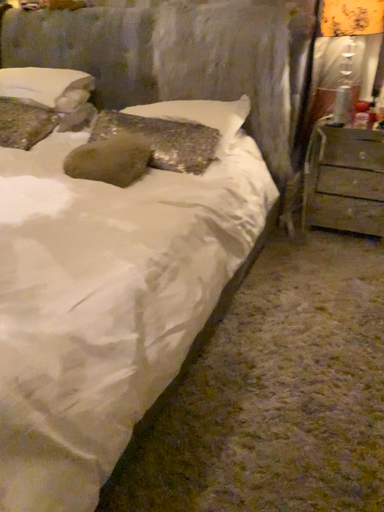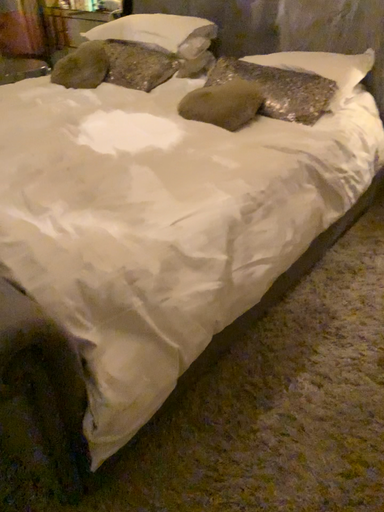
Question: How did the camera likely rotate when shooting the video?

Choices:
 (A) rotated left
 (B) rotated right

Answer: (A)